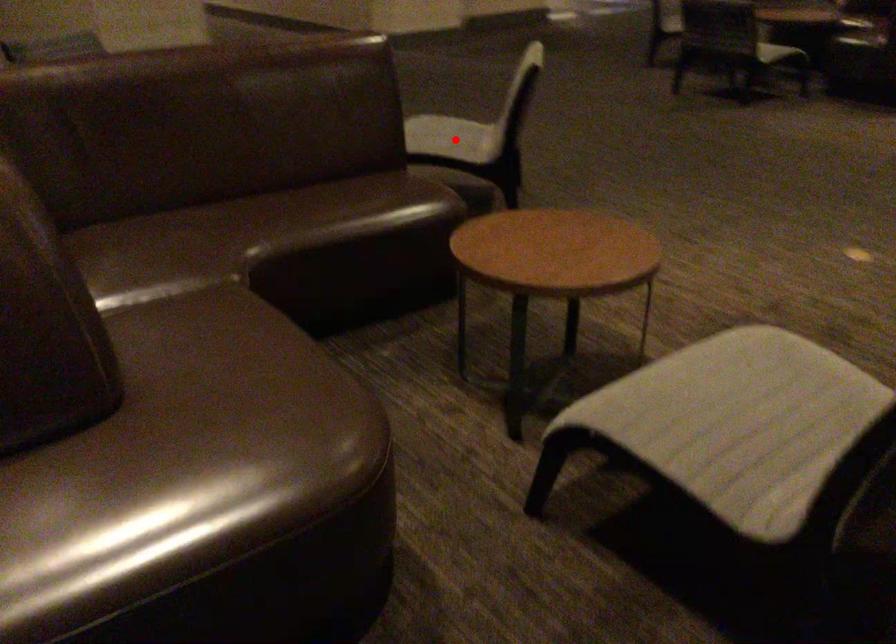
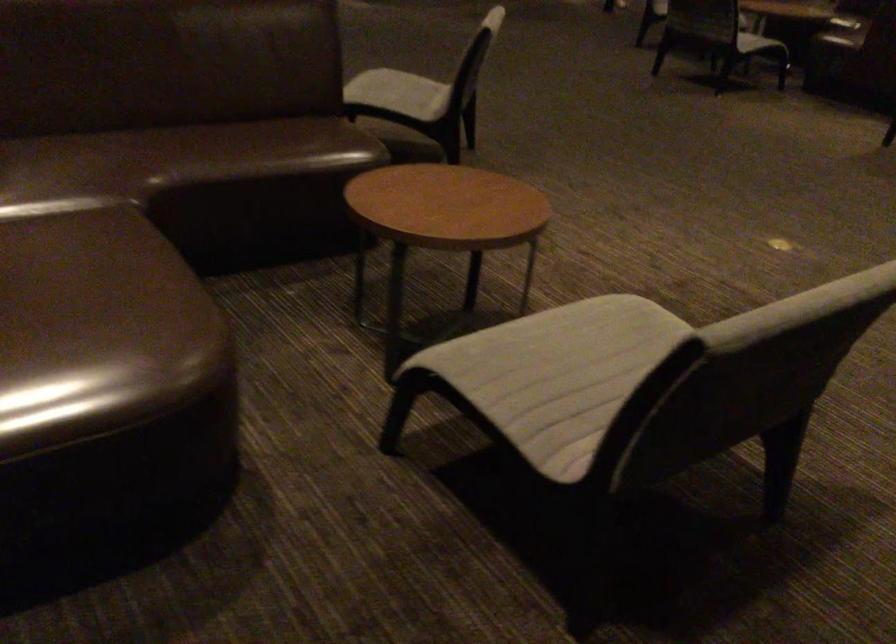
Locate, in the second image, the point that corresponds to the highlighted location in the first image.

(399, 93)